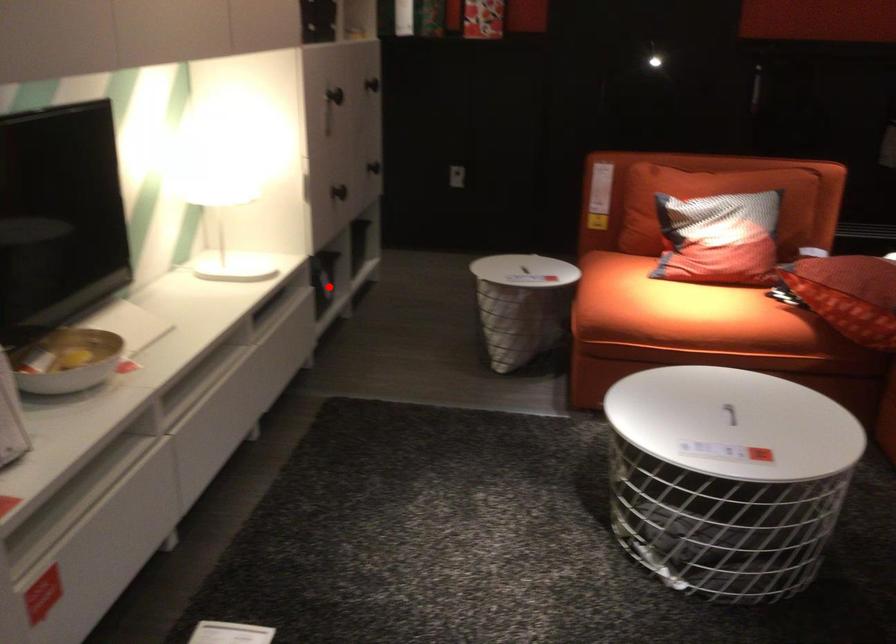
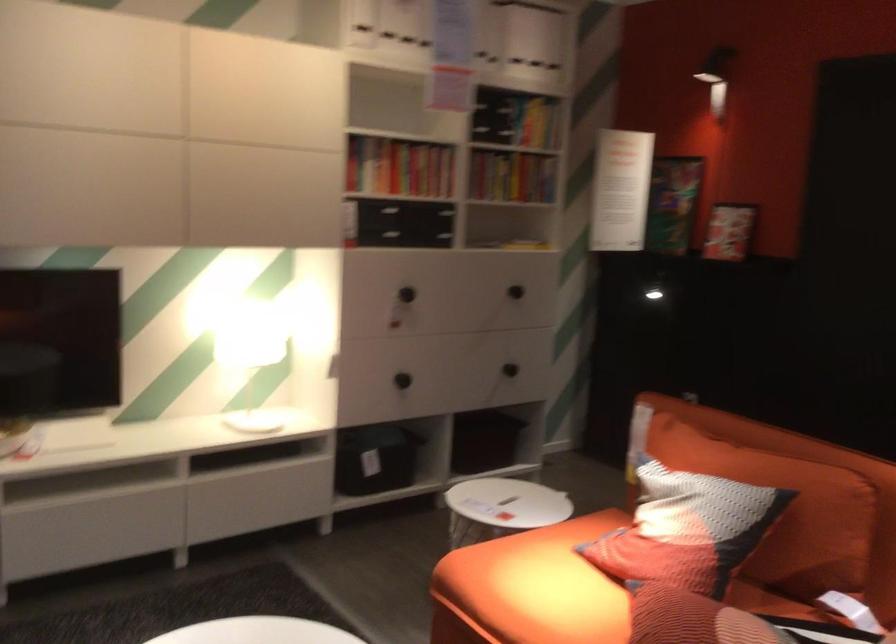
Find the pixel in the second image that matches the highlighted location in the first image.

(375, 459)